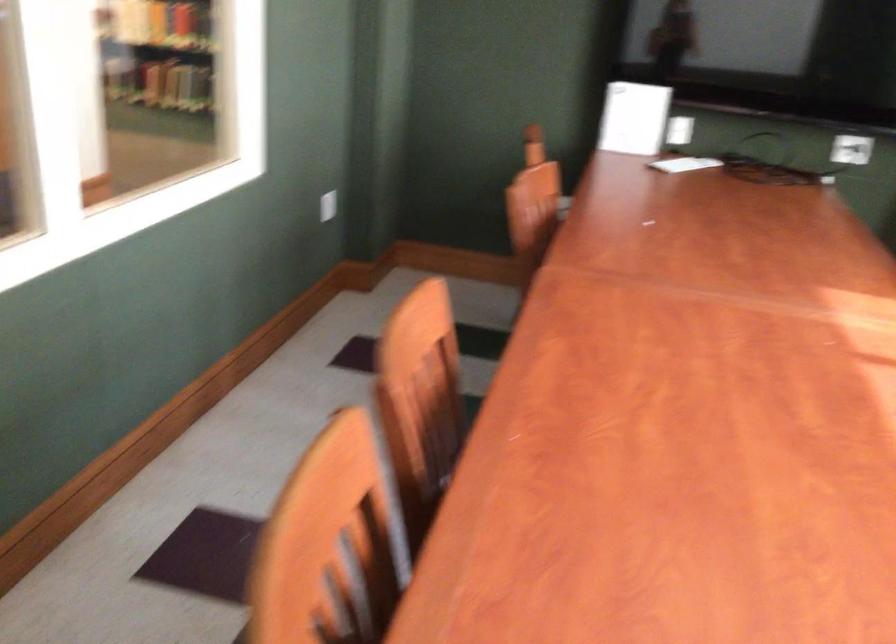
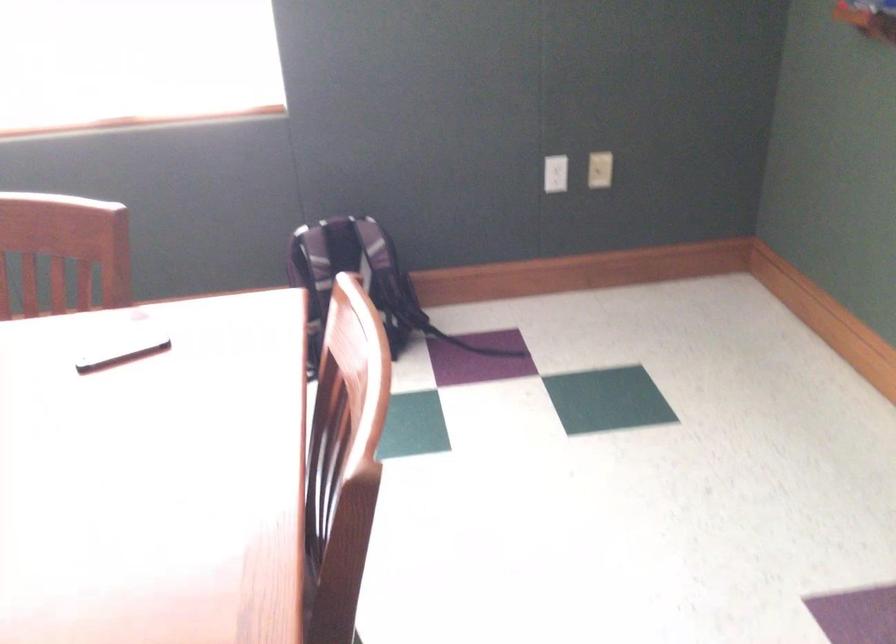
The images are taken continuously from a first-person perspective. In which direction is your viewpoint rotating?

The camera rotated toward right-down.